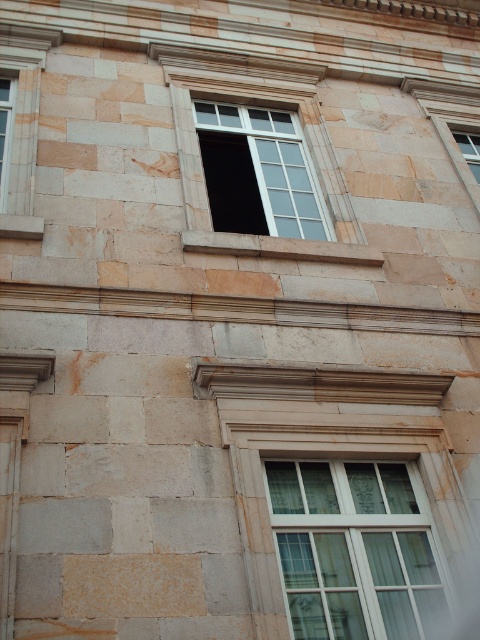
You are an architect analyzing the building facade. You notice two windows, the clear glass window at center and the transparent glass window at upper center. Which window takes up more space on the facade?

The transparent glass window at upper center occupies more space than the clear glass window at center according to the description.

You are standing in front of the building facade. There is a transparent glass window at upper center marked by point (266,168). If you want to enter the building through this window, would you need to climb up from the ground level?

The transparent glass window at upper center is located at point (266,168), which is above the ground level. Since it is positioned higher up, you would need to climb up to reach it from the ground level.